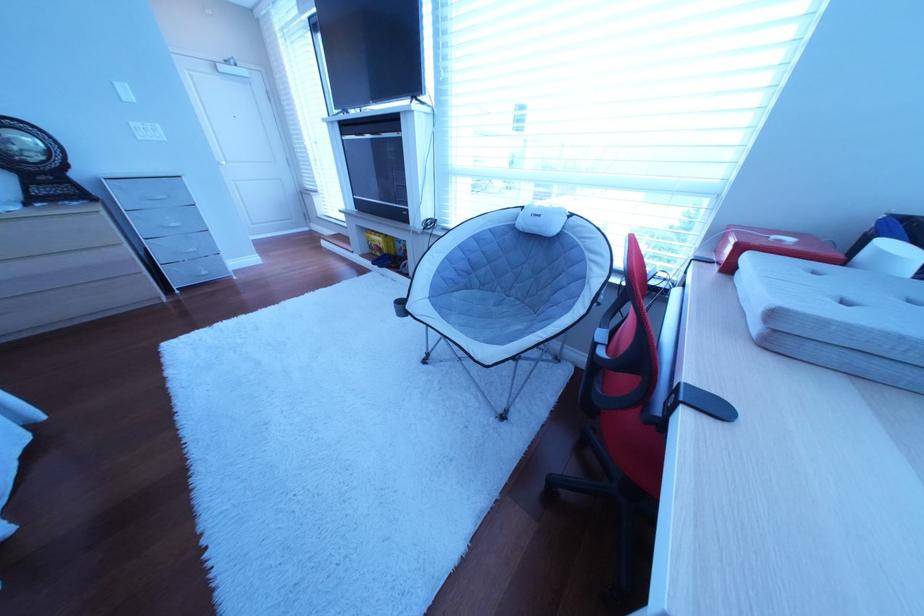
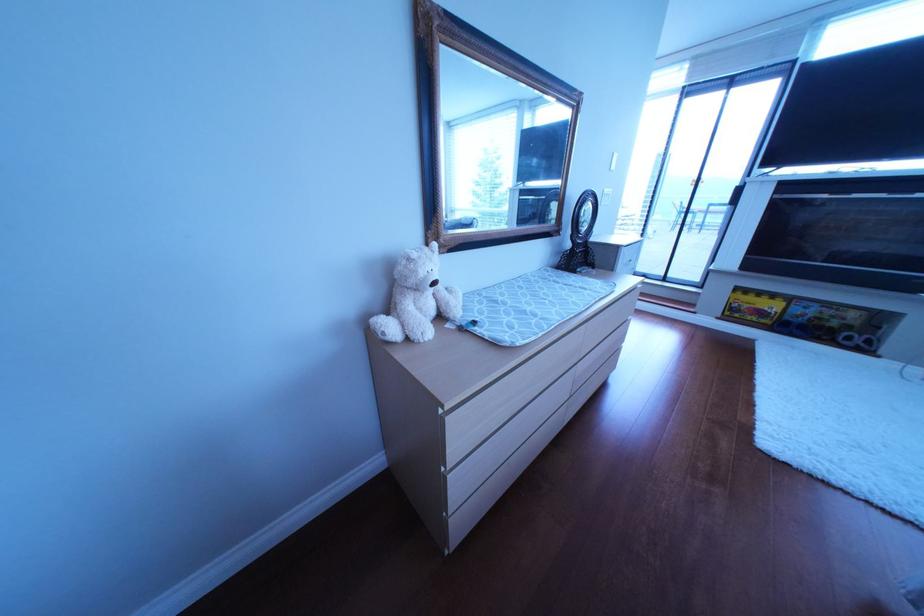
Where in the second image is the point corresponding to (375,257) from the first image?

(733, 320)